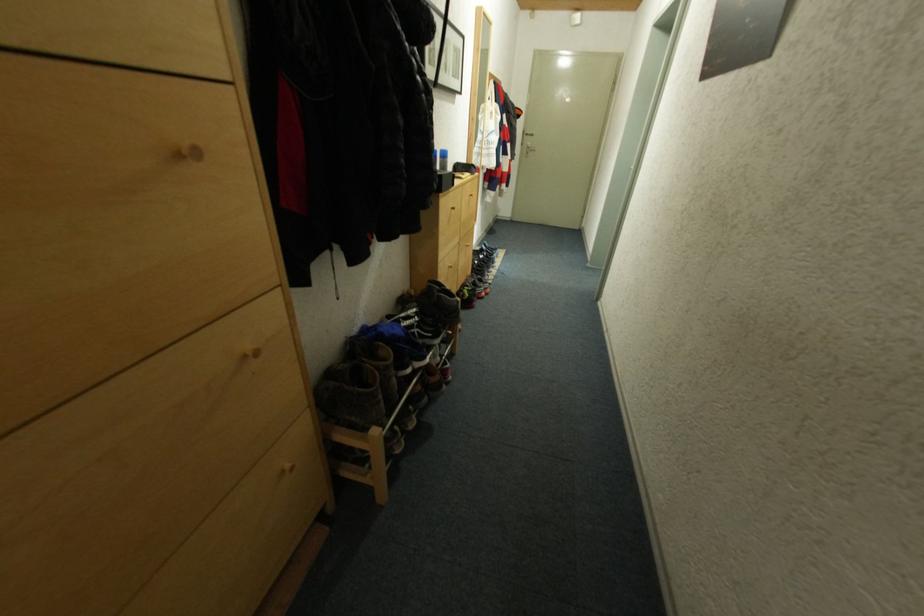
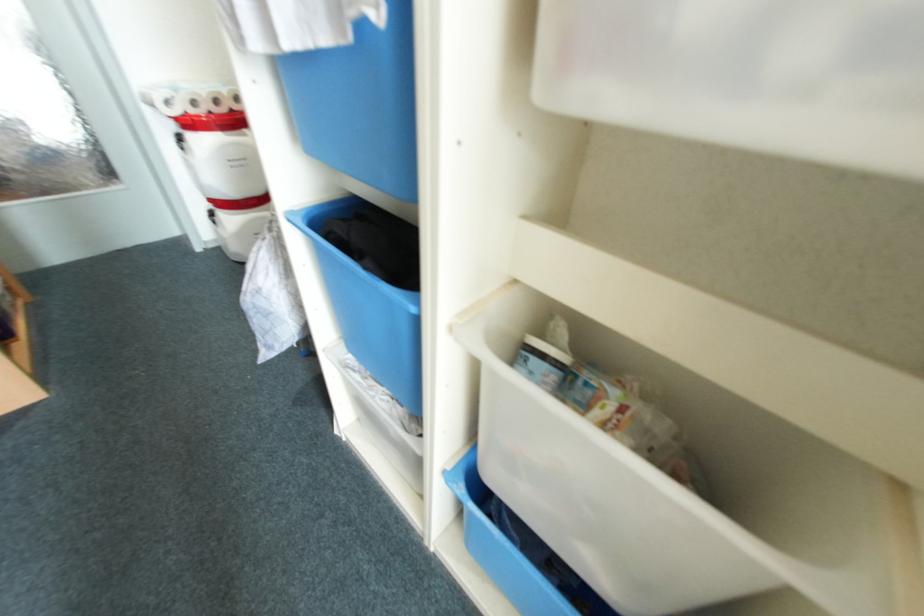
Which direction would the cameraman need to move to produce the second image?

The cameraman moved toward right, backward.